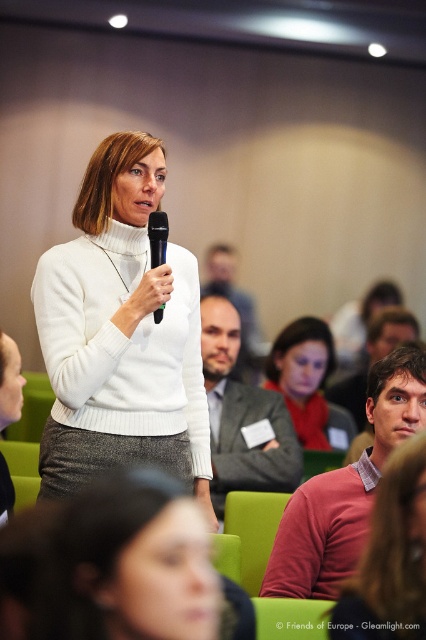
You are organizing a photo shoot and need to ensure that the two central items, the matte pink sweater at center and the gray suit jacket at center, can fit side by side on a 1.2 meter wide display stand. Based on the scene description, will they fit?

The matte pink sweater at center is wider than the gray suit jacket at center. Since the total width of both items combined would exceed the 1.2 meter stand, they might not fit side by side.

You are sitting in the front row of the conference room. You notice two points marked in the image. The first point is at coordinate point(198,496) and the second point is at coordinate point(215,397). Which point is closer to you?

Point(198,496) is in front of point(215,397), so the first point is closer to you.

You are organizing a small event and need to ensure that two speakers, wearing a matte pink sweater at center and a gray suit jacket at center, can comfortably sit side by side on a bench that is 2 meters long. Based on the image, do you think they can fit comfortably?

The distance between the matte pink sweater at center and the gray suit jacket at center is 1.21 meters. Since the bench is 2 meters long, which is significantly longer than the space they currently occupy, they should fit comfortably with extra room to spare.